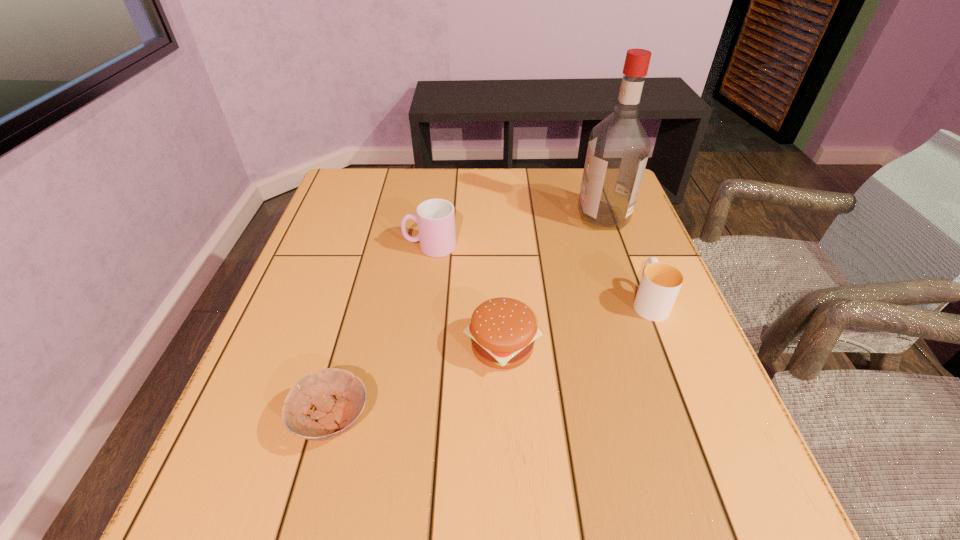
I want to click on object at the far edge, so click(x=618, y=148).

Locate an element on the screen. object that is at the left edge is located at coordinates (334, 417).

The image size is (960, 540). What are the coordinates of `liquor that is positioned at the right edge` in the screenshot? It's located at (618, 148).

The image size is (960, 540). Find the location of `cup at the right edge`. cup at the right edge is located at coordinates (661, 282).

What are the coordinates of `object that is at the far right corner` in the screenshot? It's located at (618, 148).

In the image, there is a desktop. Where is `blank space at the far edge`? blank space at the far edge is located at coordinates (535, 185).

Locate an element on the screen. Image resolution: width=960 pixels, height=540 pixels. vacant region at the left edge of the desktop is located at coordinates 334,319.

The image size is (960, 540). Find the location of `vacant space at the right edge of the desktop`. vacant space at the right edge of the desktop is located at coordinates (649, 244).

Where is `free region at the near right corner of the desktop`? Image resolution: width=960 pixels, height=540 pixels. free region at the near right corner of the desktop is located at coordinates (730, 506).

Where is `unoccupied area between the hamburger and the left cup`? The image size is (960, 540). unoccupied area between the hamburger and the left cup is located at coordinates (467, 296).